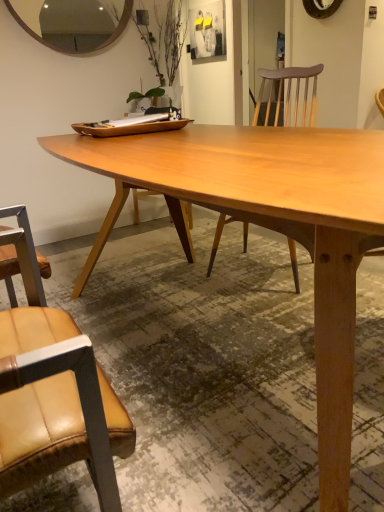
Question: Is light brown wood table at center looking in the opposite direction of wooden mirror at upper left?

Choices:
 (A) yes
 (B) no

Answer: (B)

Question: Would you say light brown wood table at center is outside wooden mirror at upper left?

Choices:
 (A) yes
 (B) no

Answer: (A)

Question: Is light brown wood table at center bigger than wooden mirror at upper left?

Choices:
 (A) no
 (B) yes

Answer: (B)

Question: Can you confirm if light brown wood table at center is taller than wooden mirror at upper left?

Choices:
 (A) yes
 (B) no

Answer: (A)

Question: Is light brown wood table at center smaller than wooden mirror at upper left?

Choices:
 (A) yes
 (B) no

Answer: (B)

Question: Is point (347, 374) positioned closer to the camera than point (115, 16)?

Choices:
 (A) closer
 (B) farther

Answer: (A)

Question: In terms of height, does light brown wood table at center look taller or shorter compared to wooden mirror at upper left?

Choices:
 (A) short
 (B) tall

Answer: (B)

Question: Based on their sizes in the image, would you say light brown wood table at center is bigger or smaller than wooden mirror at upper left?

Choices:
 (A) big
 (B) small

Answer: (A)

Question: Is light brown wood table at center situated inside wooden mirror at upper left or outside?

Choices:
 (A) inside
 (B) outside

Answer: (B)

Question: From a real-world perspective, is leather at left above or below light brown wood table at center?

Choices:
 (A) below
 (B) above

Answer: (B)

Question: In terms of size, does leather at left appear bigger or smaller than light brown wood table at center?

Choices:
 (A) big
 (B) small

Answer: (B)

Question: Visually, is leather at left positioned to the left or to the right of light brown wood table at center?

Choices:
 (A) left
 (B) right

Answer: (A)

Question: Is leather at left taller or shorter than light brown wood table at center?

Choices:
 (A) tall
 (B) short

Answer: (A)

Question: Is light brown wood table at center taller or shorter than leather at left?

Choices:
 (A) short
 (B) tall

Answer: (A)

Question: Is light brown wood table at center wider or thinner than leather at left?

Choices:
 (A) thin
 (B) wide

Answer: (B)